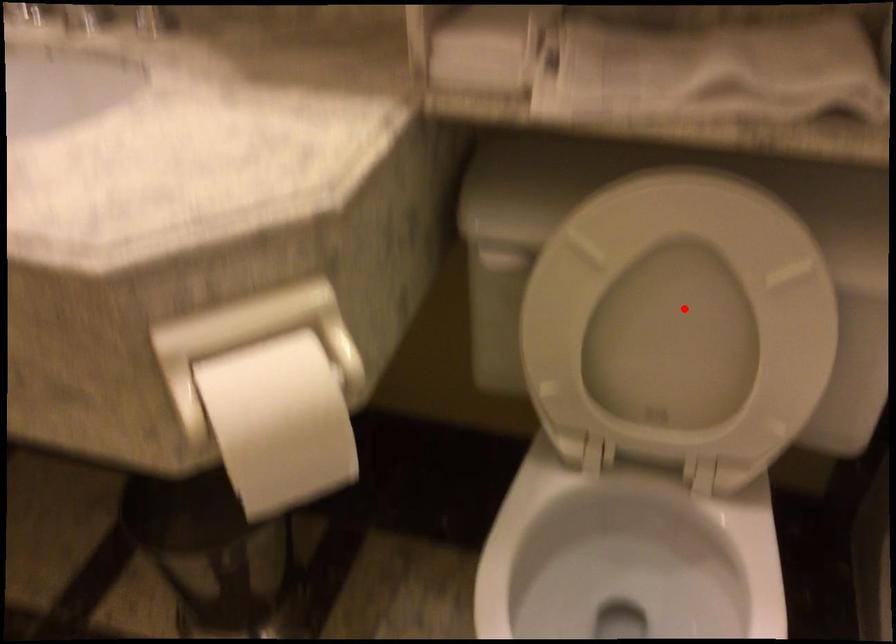
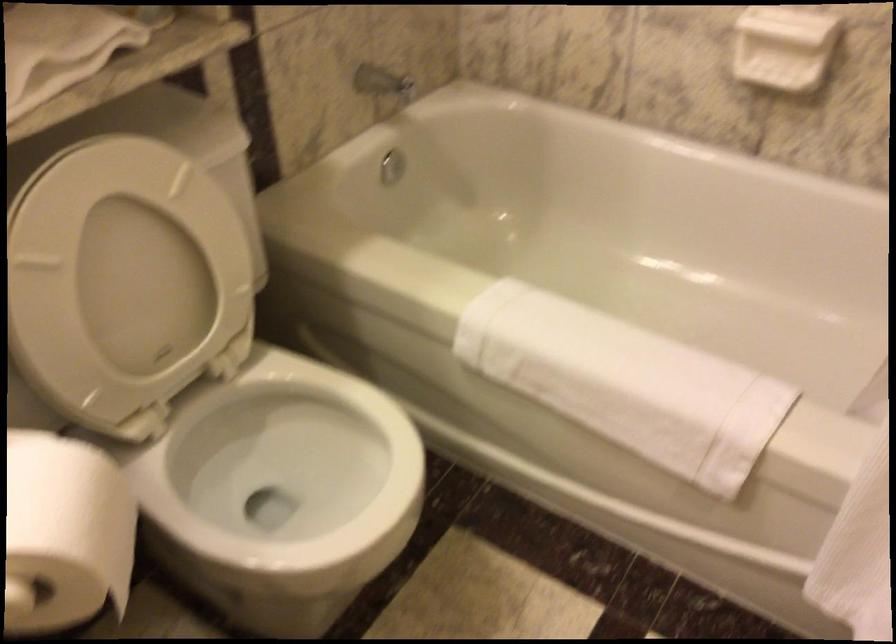
Question: A red point is marked in image1. In image2, is the corresponding 3D point closer to the camera or farther? Reply with the corresponding letter.

Choices:
 (A) The corresponding 3D point is closer.
 (B) The corresponding 3D point is farther.

Answer: (B)